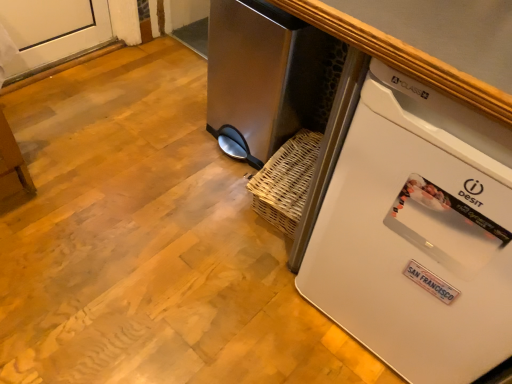
You are a GUI agent. You are given a task and a screenshot of the screen. Output one action in this format:
    pyautogui.click(x=<x>, y=<y>)
    Task: Click on the free space in front of stainless steel trash can at center
    The width and height of the screenshot is (512, 384).
    Given the screenshot: What is the action you would take?
    pyautogui.click(x=204, y=187)